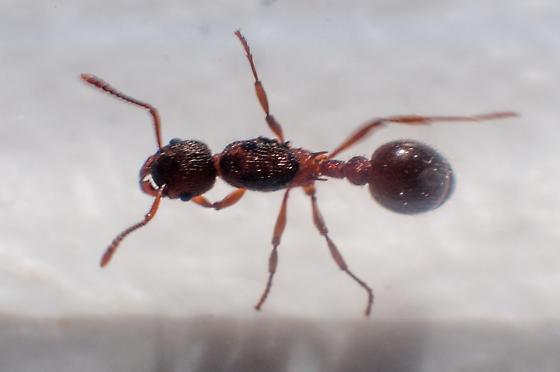
Where is `floor`? floor is located at coordinates (204, 274).